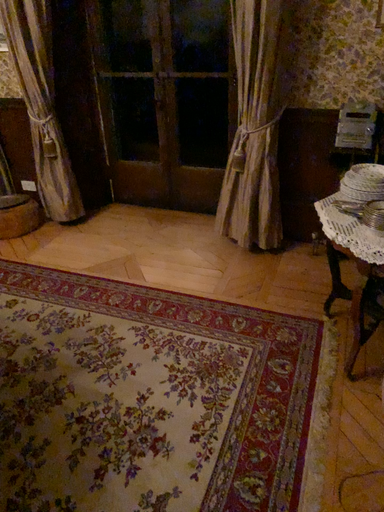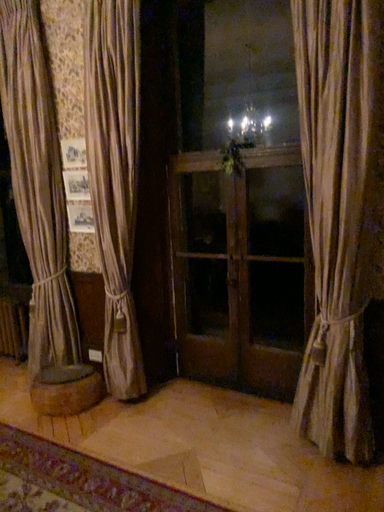
Question: Which way did the camera rotate in the video?

Choices:
 (A) rotated upward
 (B) rotated downward

Answer: (A)